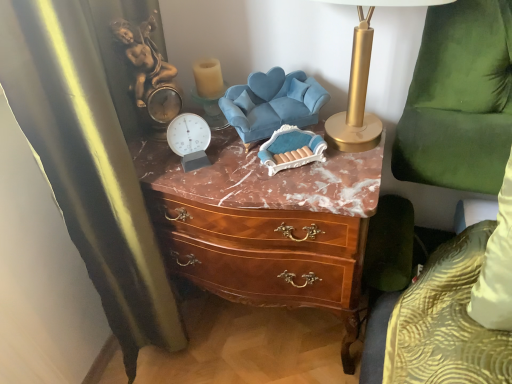
Question: Considering the positions of point (212, 104) and point (360, 104), is point (212, 104) closer or farther from the camera than point (360, 104)?

Choices:
 (A) farther
 (B) closer

Answer: (A)

Question: Choose the correct answer: Is translucent glass candle at upper center inside gold metallic table lamp at upper right or outside it?

Choices:
 (A) outside
 (B) inside

Answer: (A)

Question: Estimate the real-world distances between objects in this image. Which object is closer to the black velvet curtain at left?

Choices:
 (A) translucent glass candle at upper center
 (B) velvet blue swivel chair at center, which is the 1th swivel chair from left to right
 (C) brown wood chest of drawers at center
 (D) gold metallic table lamp at upper right
 (E) green velvet swivel chair at right, which is the 2th swivel chair from left to right

Answer: (C)

Question: Which is nearer to the brown wood chest of drawers at center?

Choices:
 (A) green velvet swivel chair at right, which is the 1th swivel chair from right to left
 (B) gold metallic table lamp at upper right
 (C) translucent glass candle at upper center
 (D) velvet blue swivel chair at center, which is the 1th swivel chair from left to right
 (E) black velvet curtain at left

Answer: (D)